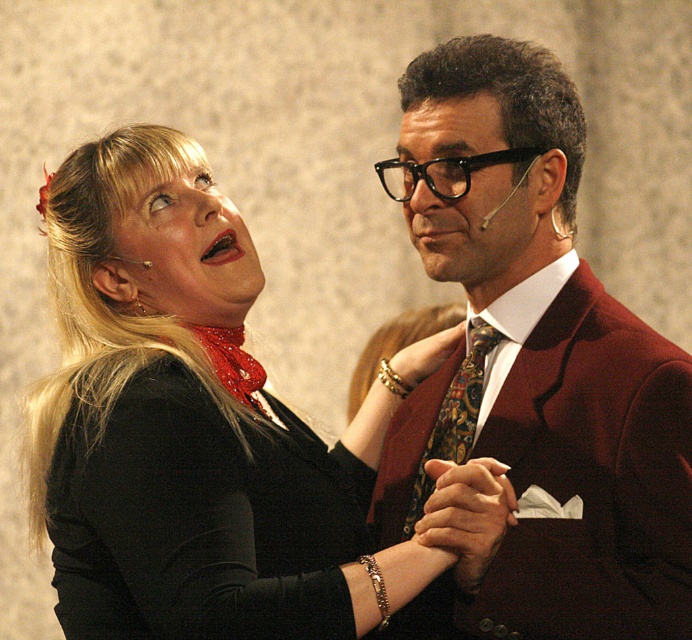
Question: Considering the real-world distances, which object is farthest from the matte black face at center?

Choices:
 (A) multicolored patterned tie at center
 (B) black velvet dress at left

Answer: (B)

Question: Does black matte blouse at upper left have a lesser width compared to black velvet dress at left?

Choices:
 (A) no
 (B) yes

Answer: (A)

Question: Can you confirm if velvet burgundy suit at center is thinner than smooth blonde hair at upper left?

Choices:
 (A) no
 (B) yes

Answer: (A)

Question: Which point is farther to the camera?

Choices:
 (A) (531, 173)
 (B) (192, 572)

Answer: (A)

Question: Is matte black face at center closer to the viewer compared to multicolored patterned tie at center?

Choices:
 (A) no
 (B) yes

Answer: (B)

Question: Which point appears farthest from the camera in this image?

Choices:
 (A) (489, 225)
 (B) (468, 608)
 (C) (188, 275)

Answer: (A)